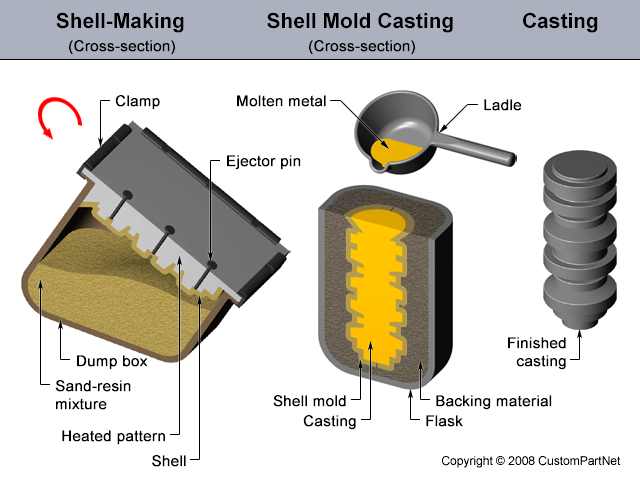
Identify the location of flask. This screenshot has height=480, width=640. (400, 387).